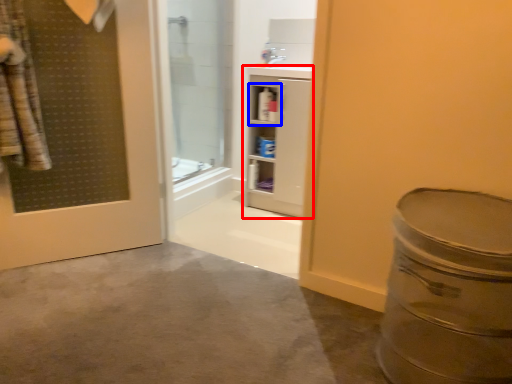
Question: Among these objects, which one is farthest to the camera, bathroom cabinet (highlighted by a red box) or cabinet (highlighted by a blue box)?

Choices:
 (A) bathroom cabinet
 (B) cabinet

Answer: (B)